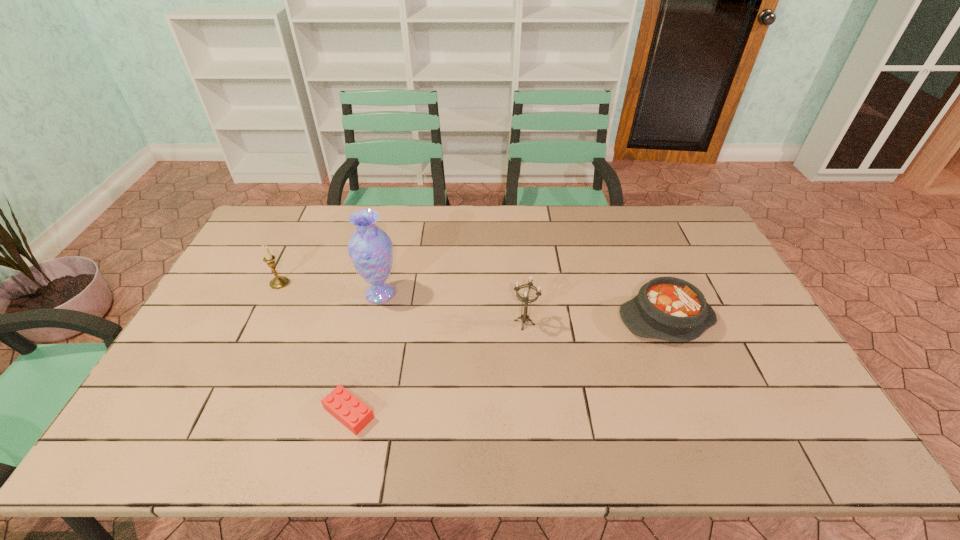
Image resolution: width=960 pixels, height=540 pixels. Find the location of `vacant space located on the front of the second object from right to left`. vacant space located on the front of the second object from right to left is located at coordinates (532, 401).

This screenshot has height=540, width=960. Identify the location of free spot located 0.070m on the back of the leftmost object. (289, 262).

Image resolution: width=960 pixels, height=540 pixels. I want to click on blank space located on the left of the rightmost object, so click(489, 319).

You are a GUI agent. You are given a task and a screenshot of the screen. Output one action in this format:
    pyautogui.click(x=<x>, y=<y>)
    Task: Click on the free space located on the left of the shortest object
    
    Given the screenshot: What is the action you would take?
    pyautogui.click(x=195, y=413)

You are a GUI agent. You are given a task and a screenshot of the screen. Output one action in this format:
    pyautogui.click(x=<x>, y=<y>)
    Task: Click on the object present at the near edge
    
    Given the screenshot: What is the action you would take?
    pyautogui.click(x=355, y=415)

Where is `object situated at the left edge`? This screenshot has width=960, height=540. object situated at the left edge is located at coordinates (x=278, y=282).

Locate an element on the screen. The width and height of the screenshot is (960, 540). object positioned at the right edge is located at coordinates (667, 308).

Where is `free spot at the far edge of the desktop`? This screenshot has width=960, height=540. free spot at the far edge of the desktop is located at coordinates (378, 221).

Find the location of a particular element. free space at the near edge is located at coordinates (268, 449).

The height and width of the screenshot is (540, 960). I want to click on free region at the left edge of the desktop, so pos(194,367).